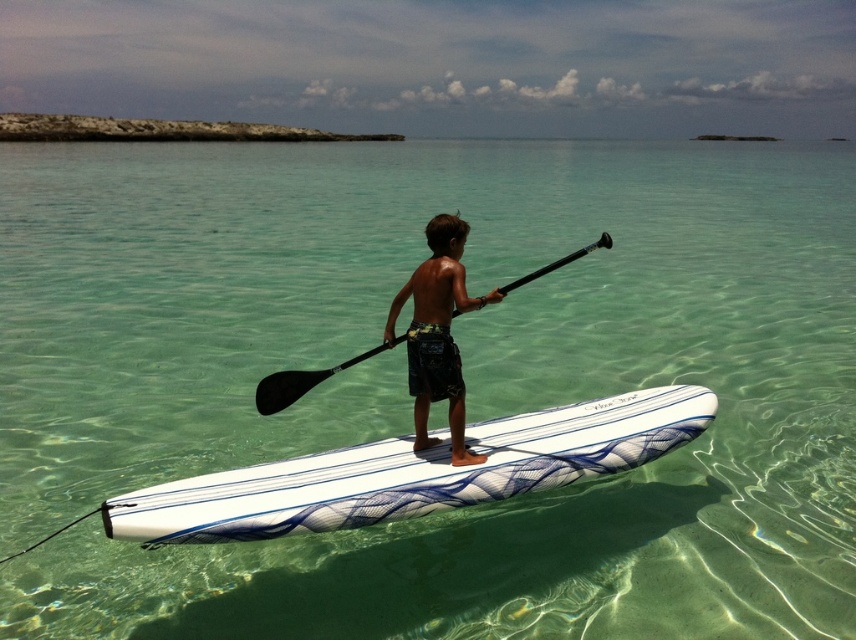
You are a photographer trying to capture the perfect shot of the white glossy surfboard at center. Based on its coordinates in the image, which are located at point 0.739, 0.484, where should you position your camera to ensure the surfboard is centered in your frame?

To center the white glossy surfboard at center in your frame, position your camera so that the crosshairs align with the coordinates 0.739 on the x axis and 0.484 on the y axis.

You are a photographer trying to capture the boy on the paddleboard. You notice the white glossy surfboard at center and the dark brown textured shorts at center. Which object is positioned to the right of the other?

The white glossy surfboard at center is to the right of the dark brown textured shorts at center.

You are a drone operator trying to capture a photo of the white glossy surfboard at center. The drone is currently at coordinates point A. To ensure the surfboard is centered in the photo, you need to adjust the drone to the correct coordinates. What are the coordinates you should set the drone to?

The coordinates you should set the drone to are point A adjusted to the position of the white glossy surfboard at center, which is at point (413, 472).